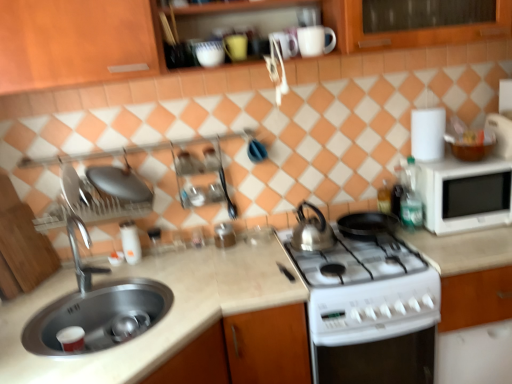
This screenshot has width=512, height=384. I want to click on vacant area that lies to the right of metallic silver canister at center, positioned as the 2th appliance in left-to-right order, so click(x=263, y=242).